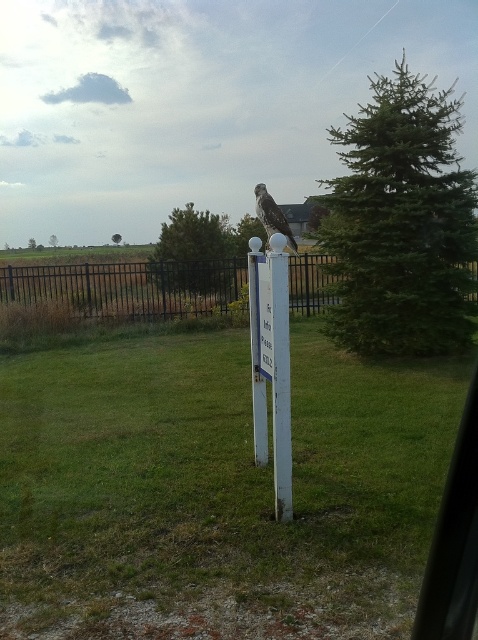
You are standing at the point marked by the coordinates point (217, 486) in the scene. What type of terrain are you currently standing on?

The point (217, 486) indicates green grass at center, so you are standing on green grass.

Looking at this image, you are standing at the bottom edge of the image where the gravel is located. You want to walk straight towards the white plastic post at center. Which direction should you walk to reach it?

Since the white plastic post at center is located at point (257, 356), you should walk straight ahead towards the center of the image to reach it.